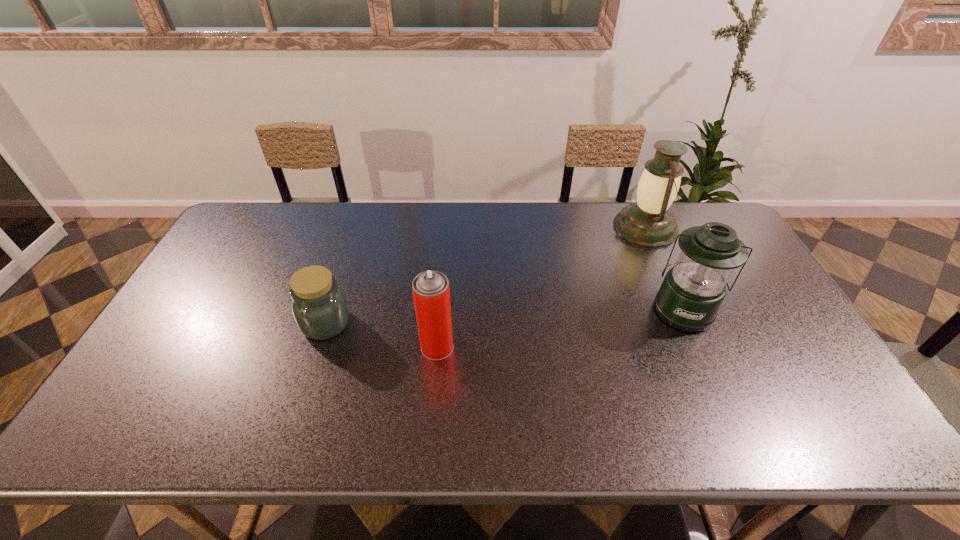
I want to click on vacant space that satisfies the following two spatial constraints: 1. with the light compartment facing forward on the nearer lantern; 2. on the left side of the farthest object, so click(x=682, y=309).

Locate an element on the screen. vacant space that satisfies the following two spatial constraints: 1. with the light compartment facing forward on the farthest object; 2. on the front side of the leftmost object is located at coordinates (687, 323).

Find the location of a particular element. vacant space that satisfies the following two spatial constraints: 1. with the light compartment facing forward on the farthest object; 2. on the left side of the nearer lantern is located at coordinates (682, 309).

I want to click on free space in the image that satisfies the following two spatial constraints: 1. on the back side of the nearer lantern; 2. with the light compartment facing forward on the farthest object, so click(647, 227).

The image size is (960, 540). I want to click on vacant region that satisfies the following two spatial constraints: 1. on the back side of the aerosol can; 2. on the left side of the nearer lantern, so coord(441,309).